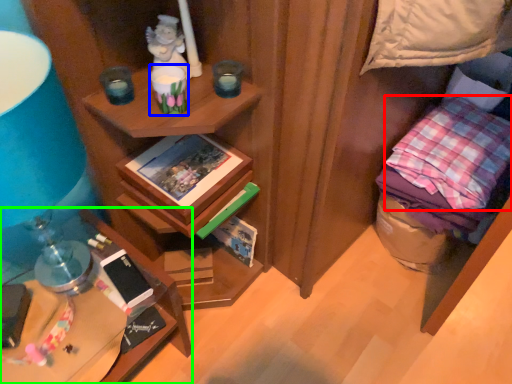
Question: Which object is positioned closest to pillow (highlighted by a red box)? Select from candle holder (highlighted by a blue box) and desk (highlighted by a green box).

Choices:
 (A) candle holder
 (B) desk

Answer: (A)